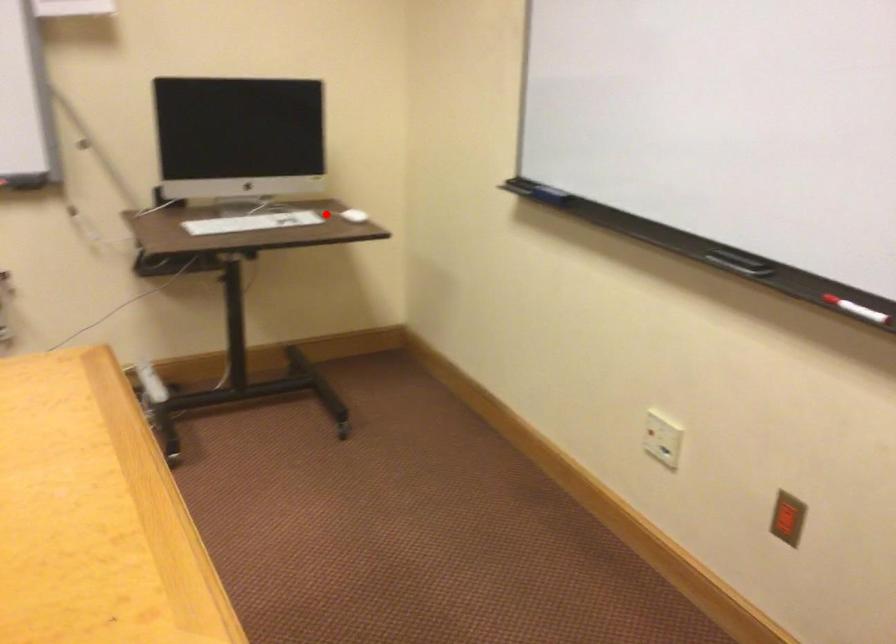
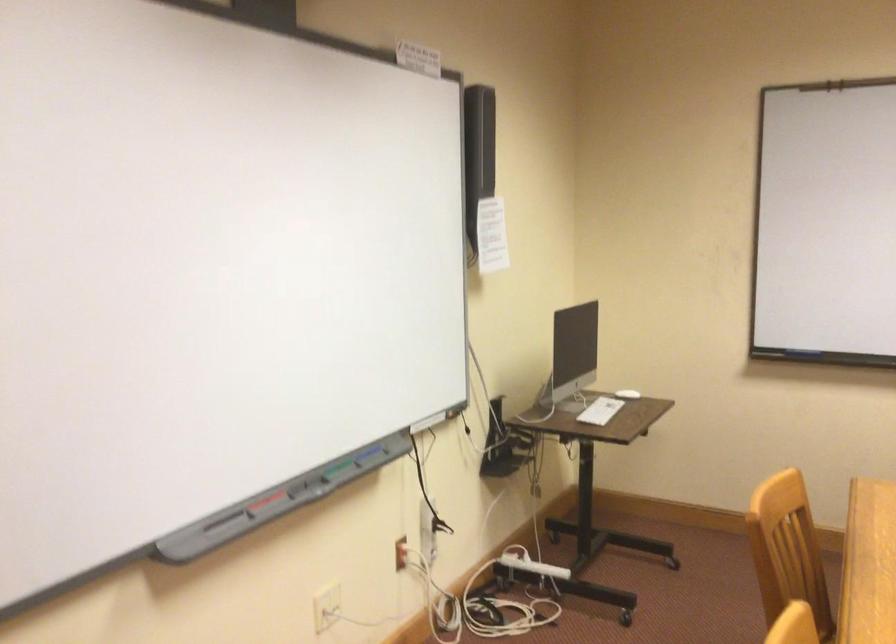
In the second image, find the point that corresponds to the highlighted location in the first image.

(627, 393)